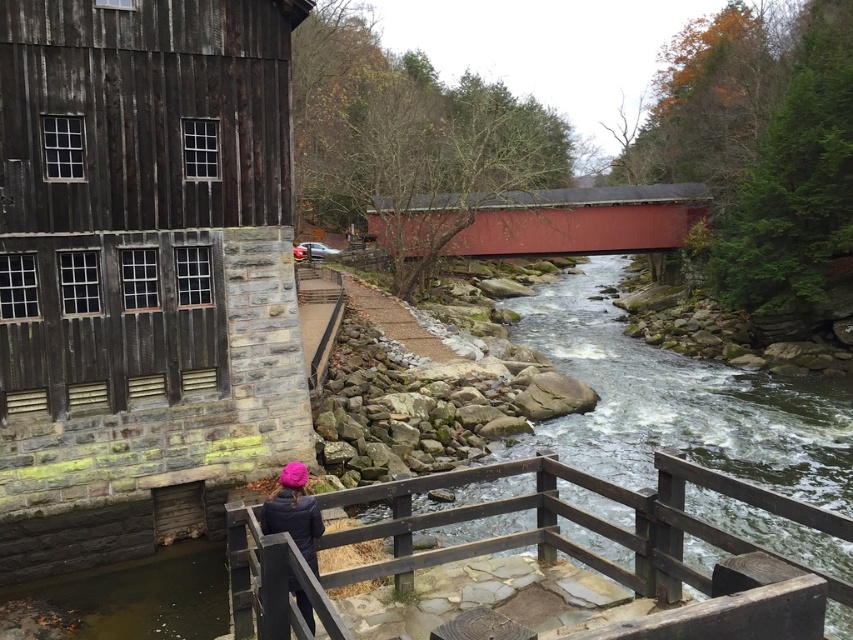
You are a visitor at this historic site and want to take a photo of the rustic wooden building on the left. You are standing near the wooden rail at center and dark blue jacket at center. Which object is shorter in height between the two?

The wooden rail at center is not as tall as dark blue jacket at center, so the wooden rail at center is shorter in height.

You are standing at the rustic wooden building on the left and want to reach the point marked at coordinate (534, 544). Which direction should you walk to get there?

The point marked at coordinate (534, 544) is on the wooden rail at center, so you should walk towards the center from the rustic wooden building on the left to reach it.

In the scene shown: You are standing at the rustic wooden building on the left and want to cross the stream to the other side. The smooth red bridge at center is your only option. Is the bridge located to the left or right of the building?

The smooth red bridge at center is located to the right of the rustic wooden building on the left because its coordinates at point (582, 220) place it in the central area, which is to the right side relative to the building positioned on the left.